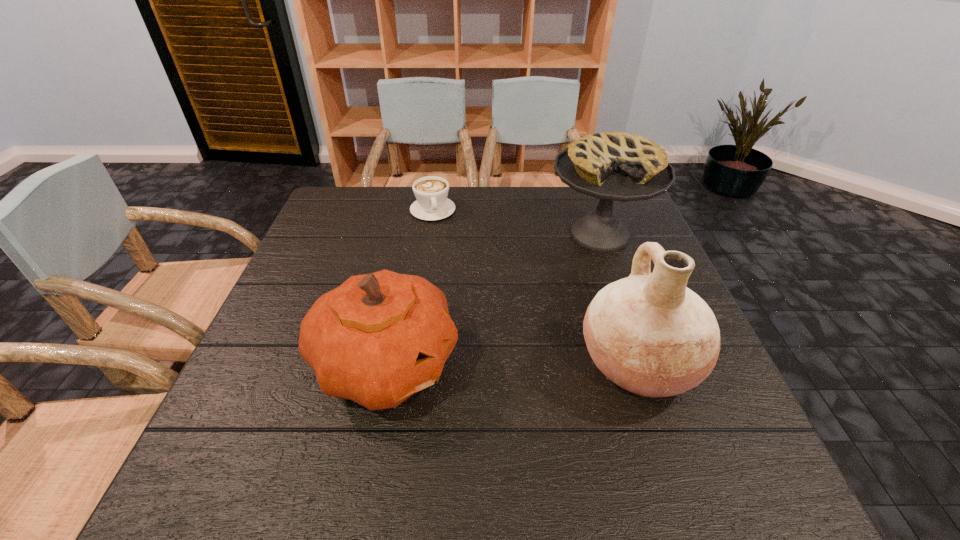
The image size is (960, 540). I want to click on vacant space that is in between the shortest object and the pie, so click(516, 222).

In order to click on free space between the pumpkin and the pie in this screenshot , I will do `click(492, 299)`.

Identify which object is located as the nearest to the pie. Please provide its 2D coordinates. Your answer should be formatted as a tuple, i.e. [(x, y)], where the tuple contains the x and y coordinates of a point satisfying the conditions above.

[(648, 333)]

Locate which object ranks second in proximity to the pumpkin. Please provide its 2D coordinates. Your answer should be formatted as a tuple, i.e. [(x, y)], where the tuple contains the x and y coordinates of a point satisfying the conditions above.

[(612, 166)]